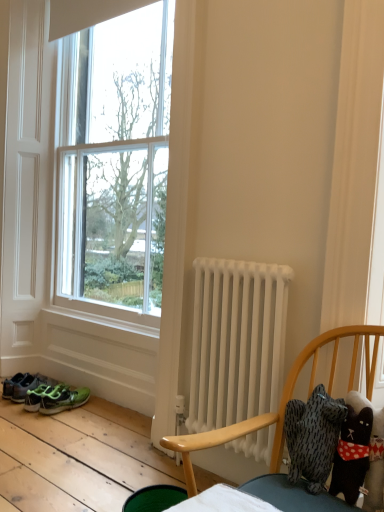
What do you see at coordinates (63, 400) in the screenshot?
I see `green matte sneakers at lower left, arranged as the second footwear when viewed from the left` at bounding box center [63, 400].

Image resolution: width=384 pixels, height=512 pixels. What are the coordinates of `green matte sneakers at lower left, arranged as the second footwear when viewed from the left` in the screenshot? It's located at (63, 400).

This screenshot has width=384, height=512. Identify the location of soft plush cat at right. (281, 400).

Would you say white matte radiator at center is to the left or to the right of white fabric curtain at right in the picture?

Clearly, white matte radiator at center is on the left of white fabric curtain at right in the image.

Is white matte radiator at center in contact with white fabric curtain at right?

white matte radiator at center and white fabric curtain at right are clearly separated.

I want to click on radiator lying below the white fabric curtain at right (from the image's perspective), so click(237, 341).

Who is smaller, white matte radiator at center or white fabric curtain at right?

Smaller between the two is white fabric curtain at right.

Looking at this image, is soft plush cat at right looking in the opposite direction of white matte radiator at center?

No, soft plush cat at right's orientation is not away from white matte radiator at center.

Is soft plush cat at right to the left of white matte radiator at center from the viewer's perspective?

No, soft plush cat at right is not to the left of white matte radiator at center.

From the image's perspective, is soft plush cat at right located above or below white matte radiator at center?

Based on their image positions, soft plush cat at right is located beneath white matte radiator at center.

From the image's perspective, which one is positioned higher, green mesh sneakers at lower left, the 2th footwear viewed from the right, or green matte sneakers at lower left, the first footwear viewed from the right?

green mesh sneakers at lower left, the 2th footwear viewed from the right, from the image's perspective.

Is green mesh sneakers at lower left, acting as the 1th footwear starting from the left, positioned far away from green matte sneakers at lower left, arranged as the second footwear when viewed from the left?

No, green mesh sneakers at lower left, acting as the 1th footwear starting from the left, is in close proximity to green matte sneakers at lower left, arranged as the second footwear when viewed from the left.

Does point (62, 397) lie behind point (56, 392)?

No, (62, 397) is in front of (56, 392).

Is green mesh sneakers at lower left, the 2th footwear viewed from the right, surrounding green matte sneakers at lower left, the first footwear viewed from the right?

No, green matte sneakers at lower left, the first footwear viewed from the right, is not inside green mesh sneakers at lower left, the 2th footwear viewed from the right.

Looking at this image, considering the positions of objects green mesh sneakers at lower left, acting as the 1th footwear starting from the left, and soft plush cat at right in the image provided, who is behind, green mesh sneakers at lower left, acting as the 1th footwear starting from the left, or soft plush cat at right?

green mesh sneakers at lower left, acting as the 1th footwear starting from the left, is further away from the camera.

Would you say green mesh sneakers at lower left, the 2th footwear viewed from the right, is inside or outside soft plush cat at right?

green mesh sneakers at lower left, the 2th footwear viewed from the right, is outside soft plush cat at right.

Considering the relative sizes of green mesh sneakers at lower left, the 2th footwear viewed from the right, and soft plush cat at right in the image provided, is green mesh sneakers at lower left, the 2th footwear viewed from the right, bigger than soft plush cat at right?

Incorrect, green mesh sneakers at lower left, the 2th footwear viewed from the right, is not larger than soft plush cat at right.

Is green mesh sneakers at lower left, the 2th footwear viewed from the right, taller or shorter than soft plush cat at right?

In the image, green mesh sneakers at lower left, the 2th footwear viewed from the right, appears to be shorter than soft plush cat at right.

Which object is positioned more to the left, white fabric curtain at right or green matte sneakers at lower left, the first footwear viewed from the right?

Positioned to the left is green matte sneakers at lower left, the first footwear viewed from the right.

Is white fabric curtain at right positioned far away from green matte sneakers at lower left, the first footwear viewed from the right?

Absolutely, white fabric curtain at right is distant from green matte sneakers at lower left, the first footwear viewed from the right.

Can you confirm if white fabric curtain at right is taller than green matte sneakers at lower left, arranged as the second footwear when viewed from the left?

Yes.

Between soft plush cat at right and white fabric curtain at right, which one appears on the right side from the viewer's perspective?

white fabric curtain at right.

Can you confirm if soft plush cat at right is taller than white fabric curtain at right?

No.

Is soft plush cat at right next to white fabric curtain at right and touching it?

soft plush cat at right and white fabric curtain at right are clearly separated.

Considering the sizes of objects soft plush cat at right and white fabric curtain at right in the image provided, who is bigger, soft plush cat at right or white fabric curtain at right?

white fabric curtain at right.

How distant is green matte sneakers at lower left, the first footwear viewed from the right, from white fabric curtain at right?

The distance of green matte sneakers at lower left, the first footwear viewed from the right, from white fabric curtain at right is 5.63 feet.

Is green matte sneakers at lower left, the first footwear viewed from the right, positioned beyond the bounds of white fabric curtain at right?

green matte sneakers at lower left, the first footwear viewed from the right, lies outside white fabric curtain at right's area.

In terms of height, does green matte sneakers at lower left, the first footwear viewed from the right, look taller or shorter compared to white fabric curtain at right?

In the image, green matte sneakers at lower left, the first footwear viewed from the right, appears to be shorter than white fabric curtain at right.

From the image's perspective, which is above, green matte sneakers at lower left, arranged as the second footwear when viewed from the left, or white fabric curtain at right?

white fabric curtain at right appears higher in the image.

Find the location of `radiator located below the white fabric curtain at right (from the image's perspective)`. radiator located below the white fabric curtain at right (from the image's perspective) is located at coordinates (237, 341).

Where is `radiator below the soft plush cat at right (from a real-world perspective)`? This screenshot has height=512, width=384. radiator below the soft plush cat at right (from a real-world perspective) is located at coordinates (237, 341).

Which object lies further to the anchor point white fabric curtain at right, white matte radiator at center or green matte sneakers at lower left, arranged as the second footwear when viewed from the left?

The object further to white fabric curtain at right is green matte sneakers at lower left, arranged as the second footwear when viewed from the left.

Considering their positions, is white matte radiator at center positioned closer to soft plush cat at right than green matte sneakers at lower left, arranged as the second footwear when viewed from the left?

Among the two, white matte radiator at center is located nearer to soft plush cat at right.

From the image, which object appears to be nearer to white matte radiator at center, soft plush cat at right or green matte sneakers at lower left, the first footwear viewed from the right?

The object closer to white matte radiator at center is soft plush cat at right.

When comparing their distances from soft plush cat at right, does white matte radiator at center or white fabric curtain at right seem further?

white fabric curtain at right is positioned further to the anchor soft plush cat at right.

Which object lies nearer to the anchor point white matte radiator at center, green matte sneakers at lower left, arranged as the second footwear when viewed from the left, or soft plush cat at right?

soft plush cat at right is positioned closer to the anchor white matte radiator at center.

Looking at the image, which one is located further to white fabric curtain at right, white matte radiator at center or soft plush cat at right?

soft plush cat at right is further to white fabric curtain at right.

Based on the photo, looking at the image, which one is located further to white fabric curtain at right, soft plush cat at right or green mesh sneakers at lower left, acting as the 1th footwear starting from the left?

green mesh sneakers at lower left, acting as the 1th footwear starting from the left, lies further to white fabric curtain at right than the other object.

Based on their spatial positions, is white matte radiator at center or white fabric curtain at right further from green mesh sneakers at lower left, acting as the 1th footwear starting from the left?

white fabric curtain at right is positioned further to the anchor green mesh sneakers at lower left, acting as the 1th footwear starting from the left.

You are a GUI agent. You are given a task and a screenshot of the screen. Output one action in this format:
    pyautogui.click(x=<x>, y=<y>)
    Task: Click on the chair between green mesh sneakers at lower left, acting as the 1th footwear starting from the left, and white fabric curtain at right, in the horizontal direction
    This screenshot has width=384, height=512.
    Given the screenshot: What is the action you would take?
    pyautogui.click(x=281, y=400)

Where is `radiator between green mesh sneakers at lower left, the 2th footwear viewed from the right, and white fabric curtain at right, in the horizontal direction`? The width and height of the screenshot is (384, 512). radiator between green mesh sneakers at lower left, the 2th footwear viewed from the right, and white fabric curtain at right, in the horizontal direction is located at coordinates (237, 341).

Locate an element on the screen. footwear situated between green mesh sneakers at lower left, acting as the 1th footwear starting from the left, and white matte radiator at center from left to right is located at coordinates (63, 400).

This screenshot has height=512, width=384. Identify the location of radiator located between green mesh sneakers at lower left, the 2th footwear viewed from the right, and soft plush cat at right in the left-right direction. (237, 341).